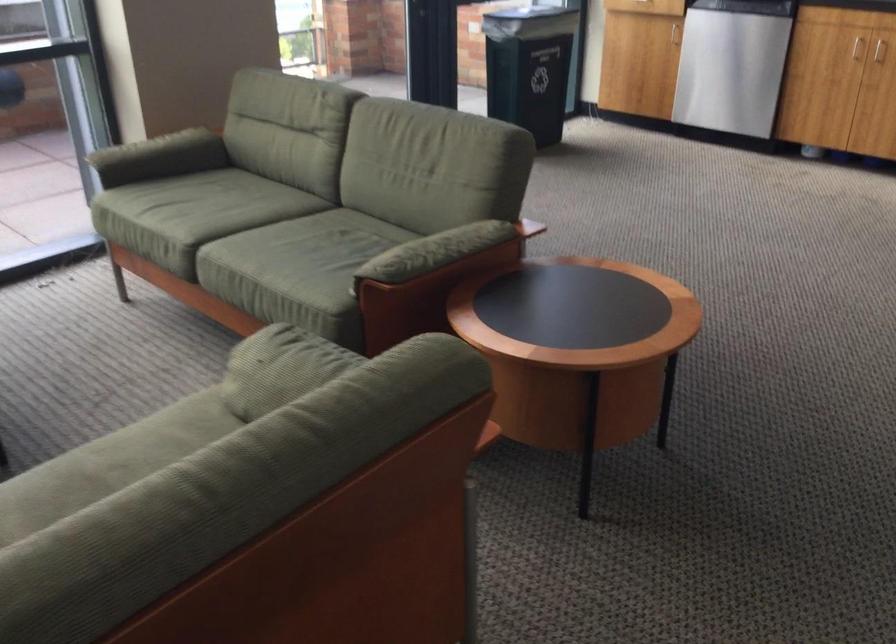
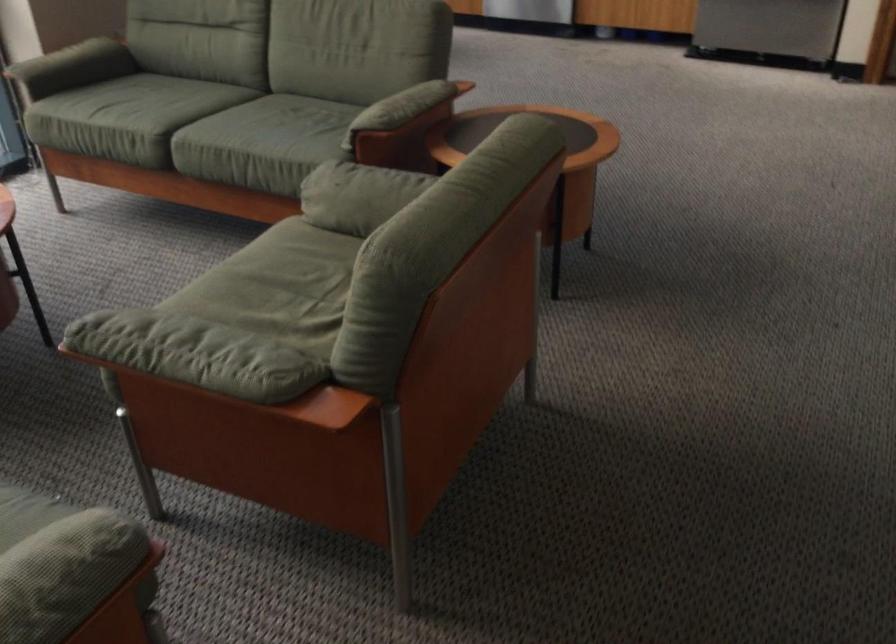
Question: I am providing you with two images of the same scene from different viewpoints. Which of the following objects are not visible in image2?

Choices:
 (A) green chair sitting surface
 (B) green sofa armrest
 (C) green chair armrest
 (D) none of these

Answer: (D)